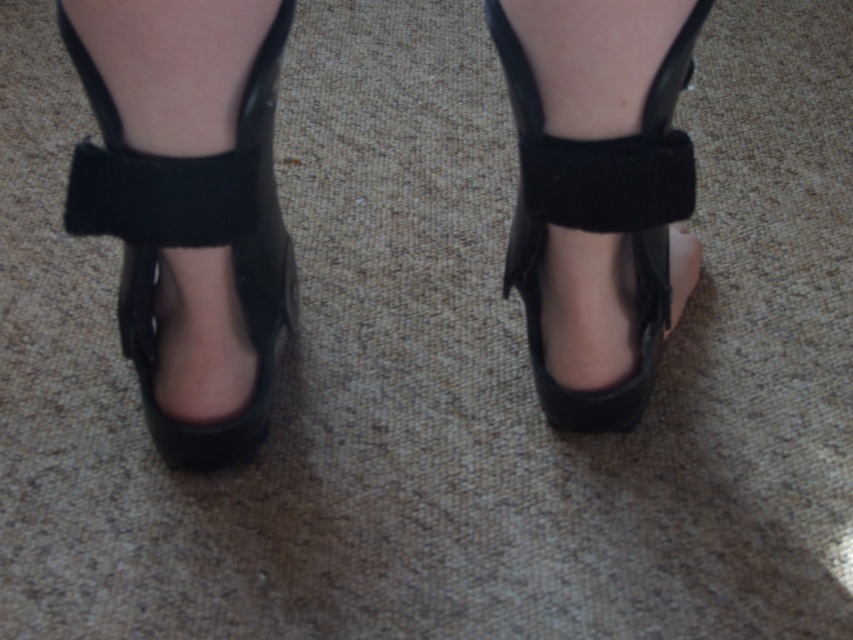
You are a photographer adjusting the focus on your camera. You need to focus on either the point at point (274, 253) or the point at point (252, 150). Which point is closer to the camera and should be focused on?

Point (274, 253) is closer to the camera than point (252, 150), so you should focus on point (274, 253).

You are standing in a room with a beige carpet and see a pair of black Mary Jane shoes. Where is the point located at coordinates (190, 241) in relation to the black leather shoe at center?

The point at coordinates (190, 241) is located at the center of the black leather shoe at center.

You are a shoe designer observing the image. You need to determine the spatial relationship between the shiny black platform shoes at center and the black leather shoe at center. Which one is positioned lower in the image?

The shiny black platform shoes at center is positioned lower than the black leather shoe at center because it is described as being below it.